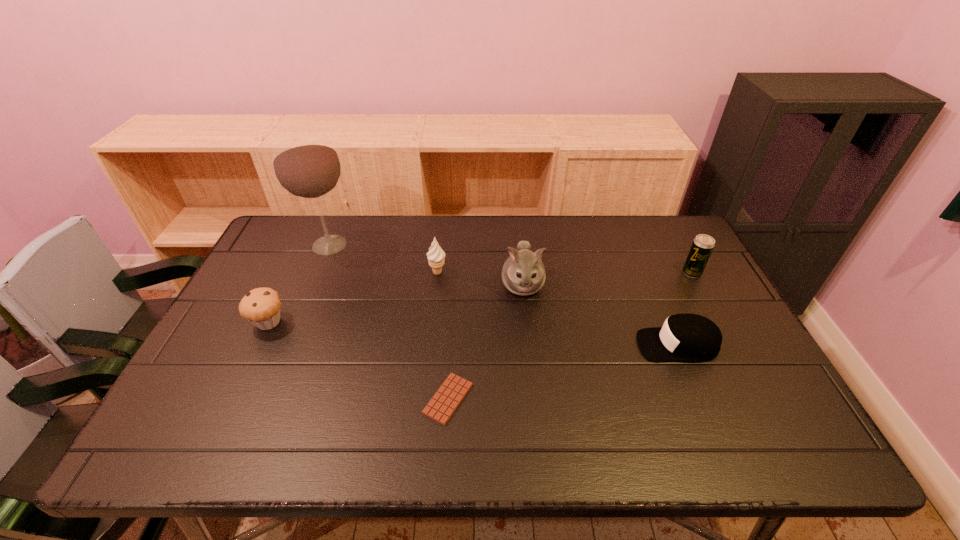
Locate an element on the screen. The image size is (960, 540). object that is the third closest one to the rightmost object is located at coordinates (446, 400).

Where is `vacant space that satisfies the following two spatial constraints: 1. on the front-facing side of the beer can; 2. on the right side of the icecream`? The height and width of the screenshot is (540, 960). vacant space that satisfies the following two spatial constraints: 1. on the front-facing side of the beer can; 2. on the right side of the icecream is located at coordinates (438, 273).

Identify the location of vacant space that satisfies the following two spatial constraints: 1. on the front-facing side of the rightmost object; 2. on the left side of the icecream. point(438,273).

At what (x,y) coordinates should I click in order to perform the action: click on free space that satisfies the following two spatial constraints: 1. on the front-facing side of the icecream; 2. on the right side of the shortest object. Please return your answer as a coordinate pair (x, y). Looking at the image, I should click on (423, 399).